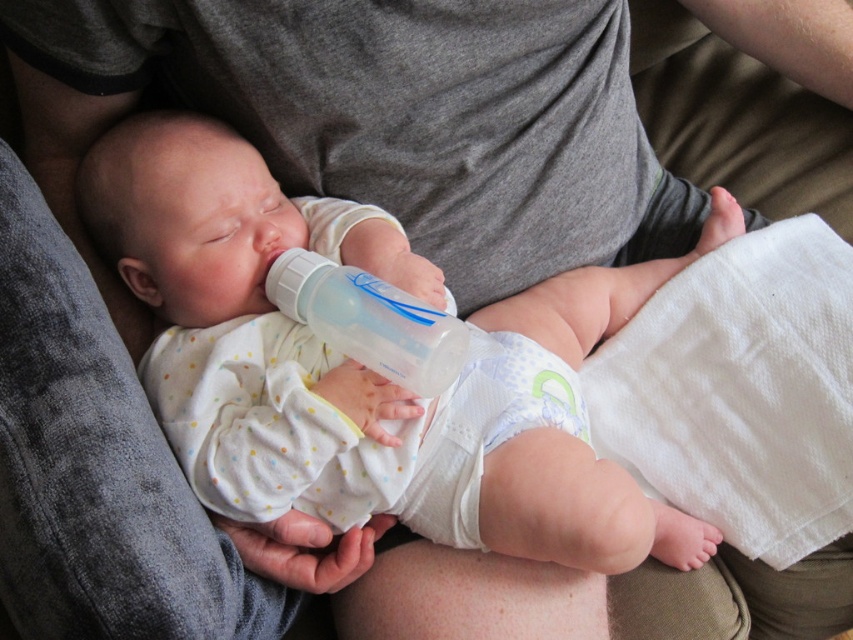
You are a caregiver who needs to choose between the white soft baby bottle at center and the white soft diaper at center to place in a vertical storage compartment that is 15 cm tall. Which item can fit vertically without exceeding the height limit?

The white soft baby bottle at center has a greater height compared to the white soft diaper at center. Since the storage compartment is 15 cm tall, the white soft diaper at center can fit vertically as it is shorter than the bottle.